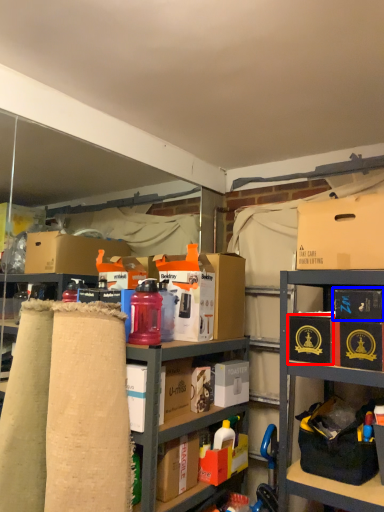
Question: Which object appears farthest to the camera in this image, box (highlighted by a red box) or box (highlighted by a blue box)?

Choices:
 (A) box
 (B) box

Answer: (A)